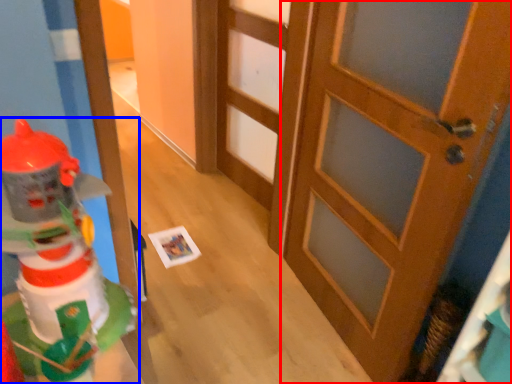
Question: Which of the following is the farthest to the observer, door (highlighted by a red box) or toy (highlighted by a blue box)?

Choices:
 (A) door
 (B) toy

Answer: (A)